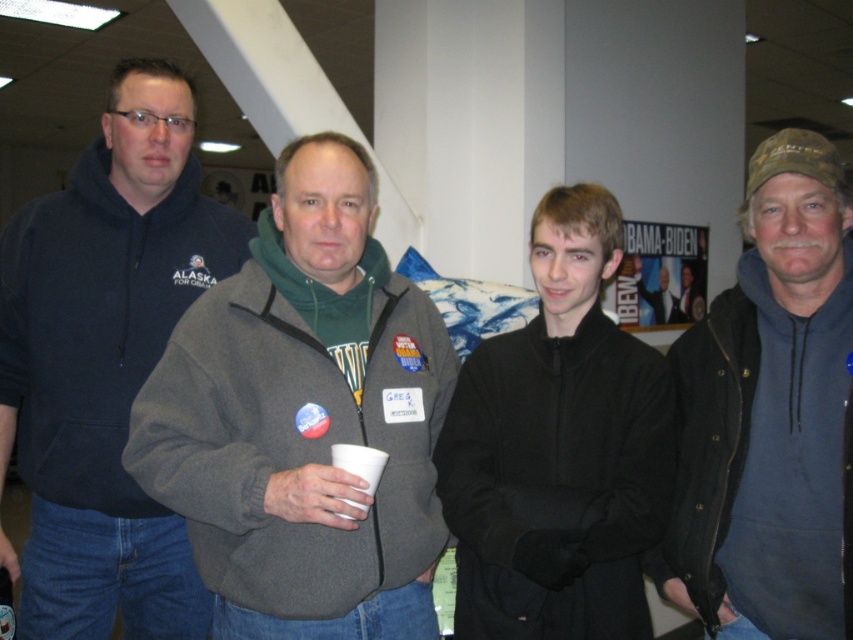
Question: From the image, what is the correct spatial relationship of gray fleece jacket at center in relation to black fleece jacket at center?

Choices:
 (A) right
 (B) left

Answer: (B)

Question: Among these objects, which one is nearest to the camera?

Choices:
 (A) gray fleece jacket at center
 (B) blue fleece jacket at right
 (C) dark blue fleece at left
 (D) black fleece jacket at center

Answer: (A)

Question: Can you confirm if gray fleece jacket at center is bigger than dark blue fleece at left?

Choices:
 (A) no
 (B) yes

Answer: (B)

Question: Is gray fleece jacket at center positioned in front of dark blue fleece at left?

Choices:
 (A) no
 (B) yes

Answer: (B)

Question: Which point is closer to the camera taking this photo?

Choices:
 (A) (161, 461)
 (B) (468, 550)
 (C) (206, 227)

Answer: (A)

Question: Which point is farther from the camera taking this photo?

Choices:
 (A) (177, 428)
 (B) (531, 380)
 (C) (834, 410)
 (D) (77, 442)

Answer: (D)